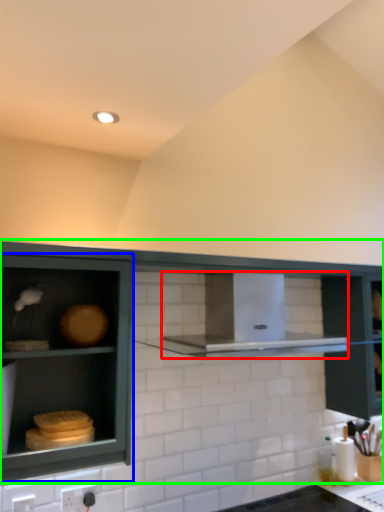
Question: Considering the real-world distances, which object is farthest from vent (highlighted by a red box)? cabinetry (highlighted by a blue box) or cabinetry (highlighted by a green box)?

Choices:
 (A) cabinetry
 (B) cabinetry

Answer: (A)